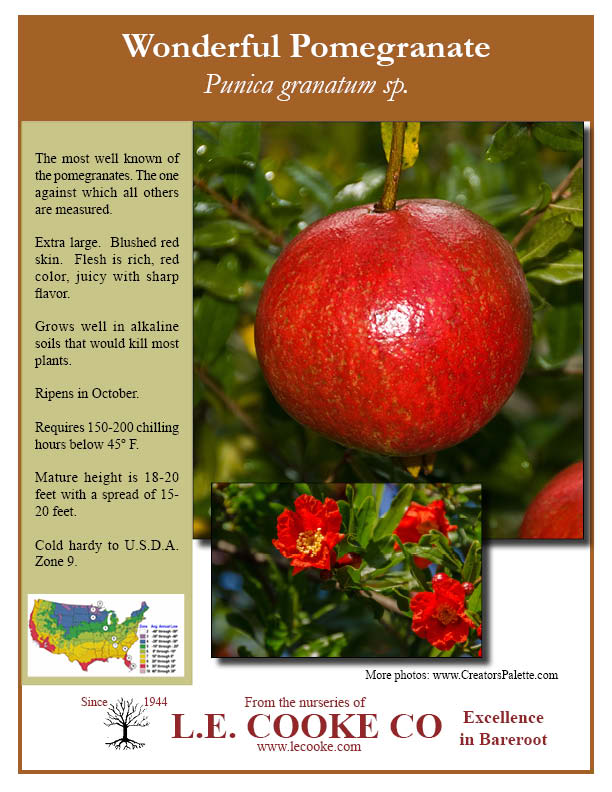
Locate an element on the screen. poster is located at coordinates (527, 604).